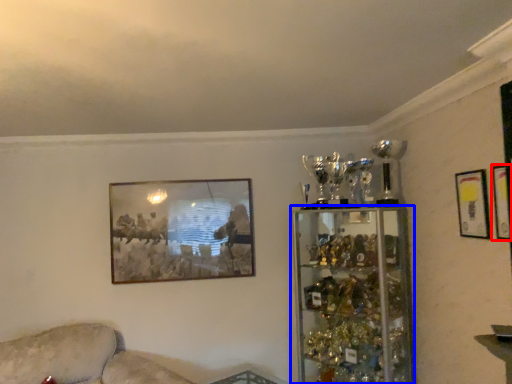
Question: Which point is closer to the camera, picture frame (highlighted by a red box) or shelf (highlighted by a blue box)?

Choices:
 (A) picture frame
 (B) shelf

Answer: (A)